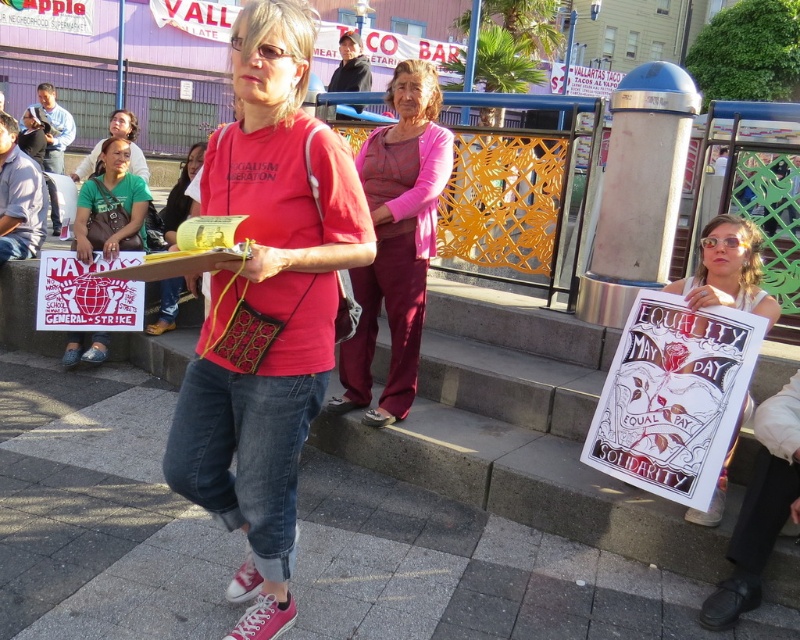
Question: Among these objects, which one is farthest from the camera?

Choices:
 (A) pink fabric shirt at center
 (B) white paper poster at right
 (C) matte yellow purse at center

Answer: (C)

Question: Does pink fabric shirt at center appear under white paper poster at right?

Choices:
 (A) no
 (B) yes

Answer: (A)

Question: Which object is farther from the camera taking this photo?

Choices:
 (A) green fabric shirt at lower left
 (B) white paper poster at right
 (C) pink fabric shirt at center
 (D) matte red t-shirt at center

Answer: (A)

Question: Which object is the farthest from the green fabric shirt at lower left?

Choices:
 (A) pink fabric shirt at center
 (B) matte yellow purse at center
 (C) matte red t-shirt at center
 (D) white paper poster at right

Answer: (D)

Question: Observing the image, what is the correct spatial positioning of matte red t-shirt at center in reference to green fabric shirt at lower left?

Choices:
 (A) below
 (B) above

Answer: (A)

Question: Is white paper poster at right thinner than matte yellow purse at center?

Choices:
 (A) yes
 (B) no

Answer: (A)